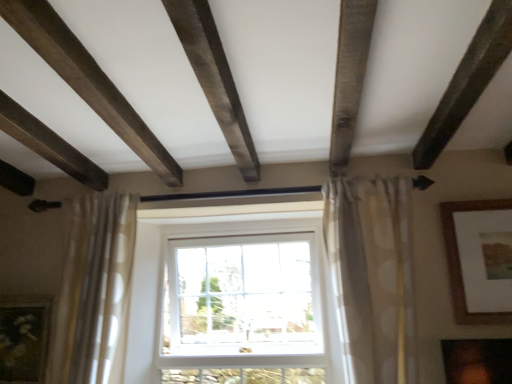
Locate an element on the screen. This screenshot has width=512, height=384. white plastic window at center is located at coordinates (233, 293).

What do you see at coordinates (24, 338) in the screenshot?
I see `matte gold picture frame at lower left, placed as the second picture frame when sorted from right to left` at bounding box center [24, 338].

What do you see at coordinates (479, 259) in the screenshot? This screenshot has height=384, width=512. I see `brown wooden picture frame at upper right, acting as the 2th picture frame starting from the left` at bounding box center [479, 259].

Locate an element on the screen. This screenshot has height=384, width=512. white sheer curtain at center, the first curtain in the right-to-left sequence is located at coordinates (372, 276).

Which is behind, white sheer curtain at center, the first curtain in the right-to-left sequence, or dark brown wood plank at upper center?

white sheer curtain at center, the first curtain in the right-to-left sequence, is further away from the camera.

Considering the sizes of objects white sheer curtain at center, which is the second curtain in left-to-right order, and dark brown wood plank at upper center in the image provided, who is smaller, white sheer curtain at center, which is the second curtain in left-to-right order, or dark brown wood plank at upper center?

dark brown wood plank at upper center.

From the image's perspective, which is above, white sheer curtain at center, which is the second curtain in left-to-right order, or dark brown wood plank at upper center?

dark brown wood plank at upper center appears higher in the image.

There is a white sheer curtain at center, the first curtain in the right-to-left sequence. Identify the location of plank above it (from a real-world perspective). The width and height of the screenshot is (512, 384). (349, 78).

Considering the positions of points (188, 325) and (347, 266), is point (188, 325) closer to camera compared to point (347, 266)?

No, it is behind (347, 266).

Image resolution: width=512 pixels, height=384 pixels. In order to click on window on the left of the white sheer curtain at center, which is the second curtain in left-to-right order in this screenshot , I will do `click(233, 293)`.

Which of these two, white plastic window at center or white sheer curtain at center, the first curtain in the right-to-left sequence, is wider?

white sheer curtain at center, the first curtain in the right-to-left sequence.

Does white plastic window at center turn towards white sheer curtain at center, the first curtain in the right-to-left sequence?

Yes, white plastic window at center is turned towards white sheer curtain at center, the first curtain in the right-to-left sequence.

Would you say beige dotted fabric curtain at left, which is the 1th curtain from left to right, is inside or outside white sheer curtain at center, which is the second curtain in left-to-right order?

beige dotted fabric curtain at left, which is the 1th curtain from left to right, is not inside white sheer curtain at center, which is the second curtain in left-to-right order, it's outside.

Is beige dotted fabric curtain at left, which appears as the 2th curtain when viewed from the right, far from white sheer curtain at center, which is the second curtain in left-to-right order?

Indeed, beige dotted fabric curtain at left, which appears as the 2th curtain when viewed from the right, is not near white sheer curtain at center, which is the second curtain in left-to-right order.

Does beige dotted fabric curtain at left, which appears as the 2th curtain when viewed from the right, turn towards white sheer curtain at center, which is the second curtain in left-to-right order?

No, beige dotted fabric curtain at left, which appears as the 2th curtain when viewed from the right, is not turned towards white sheer curtain at center, which is the second curtain in left-to-right order.

How much distance is there between beige dotted fabric curtain at left, which appears as the 2th curtain when viewed from the right, and white sheer curtain at center, the first curtain in the right-to-left sequence?

They are 3.70 feet apart.

Between dark brown wood plank at upper center and beige dotted fabric curtain at left, which appears as the 2th curtain when viewed from the right, which one is positioned behind?

beige dotted fabric curtain at left, which appears as the 2th curtain when viewed from the right, is behind.

Based on the photo, does dark brown wood plank at upper center appear on the left side of beige dotted fabric curtain at left, which appears as the 2th curtain when viewed from the right?

No, dark brown wood plank at upper center is not to the left of beige dotted fabric curtain at left, which appears as the 2th curtain when viewed from the right.

In terms of size, does dark brown wood plank at upper center appear bigger or smaller than beige dotted fabric curtain at left, which is the 1th curtain from left to right?

In the image, dark brown wood plank at upper center appears to be smaller than beige dotted fabric curtain at left, which is the 1th curtain from left to right.

At what (x,y) coordinates should I click in order to perform the action: click on picture frame above the beige dotted fabric curtain at left, which appears as the 2th curtain when viewed from the right (from the image's perspective). Please return your answer as a coordinate pair (x, y). The width and height of the screenshot is (512, 384). Looking at the image, I should click on (479, 259).

Is brown wooden picture frame at upper right, the 2th picture frame when ordered from bottom to top, positioned with its back to beige dotted fabric curtain at left, which is the 1th curtain from left to right?

No.

Are brown wooden picture frame at upper right, marked as the 1th picture frame in a top-to-bottom arrangement, and beige dotted fabric curtain at left, which is the 1th curtain from left to right, beside each other?

brown wooden picture frame at upper right, marked as the 1th picture frame in a top-to-bottom arrangement, is not next to beige dotted fabric curtain at left, which is the 1th curtain from left to right, and they're not touching.

From the picture: Is brown wooden picture frame at upper right, positioned as the first picture frame in right-to-left order, shorter than beige dotted fabric curtain at left, which is the 1th curtain from left to right?

Indeed, brown wooden picture frame at upper right, positioned as the first picture frame in right-to-left order, has a lesser height compared to beige dotted fabric curtain at left, which is the 1th curtain from left to right.

From the image's perspective, which is below, dark brown wood plank at upper center or brown wooden picture frame at upper right, the 2th picture frame when ordered from bottom to top?

brown wooden picture frame at upper right, the 2th picture frame when ordered from bottom to top.

Is dark brown wood plank at upper center turned away from brown wooden picture frame at upper right, positioned as the first picture frame in right-to-left order?

dark brown wood plank at upper center is not turned away from brown wooden picture frame at upper right, positioned as the first picture frame in right-to-left order.

Is brown wooden picture frame at upper right, acting as the 2th picture frame starting from the left, inside dark brown wood plank at upper center?

No.

Locate an element on the screen. window behind the matte gold picture frame at lower left, the 2th picture frame in the top-to-bottom sequence is located at coordinates (x=233, y=293).

Is matte gold picture frame at lower left, the 2th picture frame in the top-to-bottom sequence, next to white plastic window at center and touching it?

matte gold picture frame at lower left, the 2th picture frame in the top-to-bottom sequence, and white plastic window at center are not in contact.

In the scene shown: Considering the sizes of matte gold picture frame at lower left, the 2th picture frame in the top-to-bottom sequence, and white plastic window at center in the image, is matte gold picture frame at lower left, the 2th picture frame in the top-to-bottom sequence, taller or shorter than white plastic window at center?

Clearly, matte gold picture frame at lower left, the 2th picture frame in the top-to-bottom sequence, is shorter compared to white plastic window at center.

Is matte gold picture frame at lower left, marked as the 1th picture frame in a bottom-to-top arrangement, aimed at white plastic window at center?

No, matte gold picture frame at lower left, marked as the 1th picture frame in a bottom-to-top arrangement, is not oriented towards white plastic window at center.

Where is `plank that is above the white sheer curtain at center, the first curtain in the right-to-left sequence (from the image's perspective)`? plank that is above the white sheer curtain at center, the first curtain in the right-to-left sequence (from the image's perspective) is located at coordinates (349, 78).

The height and width of the screenshot is (384, 512). I want to click on window below the white sheer curtain at center, which is the second curtain in left-to-right order (from the image's perspective), so click(233, 293).

When comparing their distances from brown wooden picture frame at upper right, marked as the 1th picture frame in a top-to-bottom arrangement, does beige dotted fabric curtain at left, which is the 1th curtain from left to right, or white sheer curtain at center, the first curtain in the right-to-left sequence, seem closer?

white sheer curtain at center, the first curtain in the right-to-left sequence, is closer to brown wooden picture frame at upper right, marked as the 1th picture frame in a top-to-bottom arrangement.

Which object lies further to the anchor point brown wooden picture frame at upper right, marked as the 1th picture frame in a top-to-bottom arrangement, matte gold picture frame at lower left, placed as the second picture frame when sorted from right to left, or white plastic window at center?

Among the two, matte gold picture frame at lower left, placed as the second picture frame when sorted from right to left, is located further to brown wooden picture frame at upper right, marked as the 1th picture frame in a top-to-bottom arrangement.

Based on their spatial positions, is brown wooden picture frame at upper right, positioned as the first picture frame in right-to-left order, or white plastic window at center closer to dark brown wood plank at upper center?

brown wooden picture frame at upper right, positioned as the first picture frame in right-to-left order, lies closer to dark brown wood plank at upper center than the other object.

Which object lies nearer to the anchor point white plastic window at center, dark brown wood plank at upper center or white sheer curtain at center, the first curtain in the right-to-left sequence?

white sheer curtain at center, the first curtain in the right-to-left sequence, lies closer to white plastic window at center than the other object.

Considering their positions, is matte gold picture frame at lower left, placed as the second picture frame when sorted from right to left, positioned closer to dark brown wood plank at upper center than brown wooden picture frame at upper right, the 2th picture frame when ordered from bottom to top?

brown wooden picture frame at upper right, the 2th picture frame when ordered from bottom to top, lies closer to dark brown wood plank at upper center than the other object.

Considering their positions, is white plastic window at center positioned closer to white sheer curtain at center, the first curtain in the right-to-left sequence, than dark brown wood plank at upper center?

dark brown wood plank at upper center is positioned closer to the anchor white sheer curtain at center, the first curtain in the right-to-left sequence.

Based on the photo, looking at the image, which one is located further to matte gold picture frame at lower left, marked as the 1th picture frame in a bottom-to-top arrangement, white plastic window at center or white sheer curtain at center, which is the second curtain in left-to-right order?

white sheer curtain at center, which is the second curtain in left-to-right order.

Considering their positions, is beige dotted fabric curtain at left, which is the 1th curtain from left to right, positioned further to matte gold picture frame at lower left, the first picture frame when ordered from left to right, than white plastic window at center?

Based on the image, white plastic window at center appears to be further to matte gold picture frame at lower left, the first picture frame when ordered from left to right.

Identify the location of curtain between matte gold picture frame at lower left, the first picture frame when ordered from left to right, and dark brown wood plank at upper center, in the horizontal direction. (95, 290).

Find the location of a particular element. This screenshot has height=384, width=512. window situated between beige dotted fabric curtain at left, which is the 1th curtain from left to right, and white sheer curtain at center, which is the second curtain in left-to-right order, from left to right is located at coordinates (233, 293).

This screenshot has height=384, width=512. Find the location of `window between matte gold picture frame at lower left, marked as the 1th picture frame in a bottom-to-top arrangement, and dark brown wood plank at upper center, in the horizontal direction`. window between matte gold picture frame at lower left, marked as the 1th picture frame in a bottom-to-top arrangement, and dark brown wood plank at upper center, in the horizontal direction is located at coordinates (233, 293).

Find the location of a particular element. curtain between white plastic window at center and brown wooden picture frame at upper right, positioned as the first picture frame in right-to-left order is located at coordinates (372, 276).